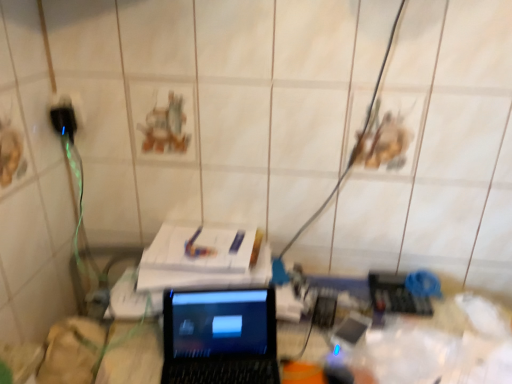
Question: From a real-world perspective, is black plastic plug at left physically below black glossy laptop at center?

Choices:
 (A) yes
 (B) no

Answer: (B)

Question: Is black plastic plug at left completely or partially outside of black glossy laptop at center?

Choices:
 (A) no
 (B) yes

Answer: (B)

Question: Can you confirm if black plastic plug at left is thinner than black glossy laptop at center?

Choices:
 (A) no
 (B) yes

Answer: (B)

Question: Does black plastic plug at left touch black glossy laptop at center?

Choices:
 (A) yes
 (B) no

Answer: (B)

Question: From the image's perspective, is black plastic plug at left under black glossy laptop at center?

Choices:
 (A) yes
 (B) no

Answer: (B)

Question: Can you confirm if black plastic plug at left is bigger than black glossy laptop at center?

Choices:
 (A) no
 (B) yes

Answer: (A)

Question: Can you confirm if black glossy laptop at center is positioned to the left of black plastic plug at left?

Choices:
 (A) no
 (B) yes

Answer: (A)

Question: Considering the relative sizes of black glossy laptop at center and black plastic plug at left in the image provided, is black glossy laptop at center taller than black plastic plug at left?

Choices:
 (A) yes
 (B) no

Answer: (A)

Question: Can you confirm if black glossy laptop at center is wider than black plastic plug at left?

Choices:
 (A) no
 (B) yes

Answer: (B)

Question: From the image's perspective, is black glossy laptop at center beneath black plastic plug at left?

Choices:
 (A) no
 (B) yes

Answer: (B)

Question: From a real-world perspective, is black glossy laptop at center on top of black plastic plug at left?

Choices:
 (A) no
 (B) yes

Answer: (A)

Question: Is black glossy laptop at center smaller than black plastic plug at left?

Choices:
 (A) no
 (B) yes

Answer: (A)

Question: Considering the positions of black glossy laptop at center and black plastic plug at left in the image, is black glossy laptop at center taller or shorter than black plastic plug at left?

Choices:
 (A) short
 (B) tall

Answer: (B)